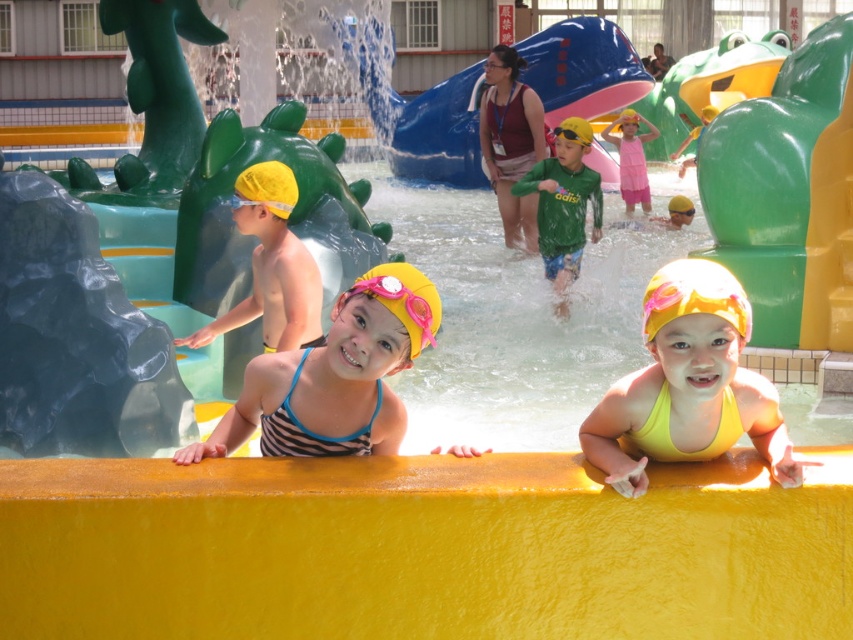
I want to click on yellow matte swimsuit at center, so click(688, 385).

Which is more to the left, yellow matte swimsuit at center or blue rubber slide at center?

yellow matte swimsuit at center

Which is behind, point (721, 413) or point (595, 60)?

The point (595, 60) is more distant.

The image size is (853, 640). In order to click on yellow matte swimsuit at center in this screenshot , I will do `click(688, 385)`.

Is yellow matte swimsuit at center positioned before striped fabric swimsuit at center?

Yes.

How much distance is there between yellow matte swimsuit at center and striped fabric swimsuit at center?

1.57 meters

Is point (737, 388) positioned in front of point (271, 397)?

Yes.

I want to click on yellow matte swimsuit at center, so click(688, 385).

This screenshot has width=853, height=640. Describe the element at coordinates (271, 266) in the screenshot. I see `yellow matte swim cap at center` at that location.

Between point (257, 179) and point (537, 192), which one is positioned behind?

The point (537, 192) is behind.

Between point (292, 189) and point (534, 192), which one is positioned in front?

Positioned in front is point (292, 189).

The image size is (853, 640). Find the location of `yellow matte swim cap at center`. yellow matte swim cap at center is located at coordinates (271, 266).